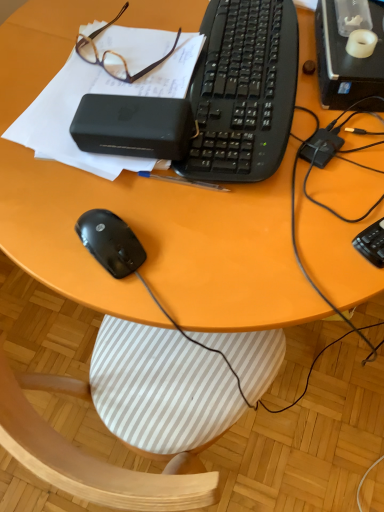
Locate an element on the screen. The width and height of the screenshot is (384, 512). vacant area that is in front of black matte mouse at lower left is located at coordinates (128, 295).